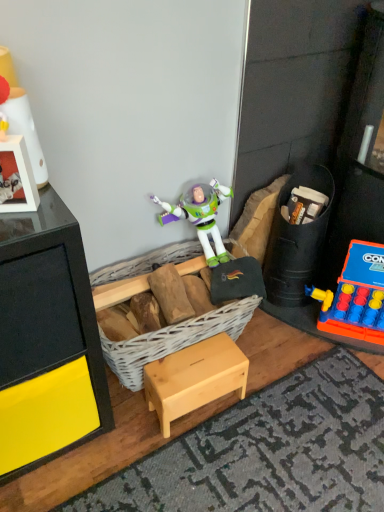
Question: Considering the relative sizes of natural wood stool at center and rubberized plastic game at right, positioned as the first toy in right-to-left order, in the image provided, is natural wood stool at center thinner than rubberized plastic game at right, positioned as the first toy in right-to-left order,?

Choices:
 (A) no
 (B) yes

Answer: (A)

Question: Is natural wood stool at center not inside rubberized plastic game at right, which appears as the 2th toy when viewed from the back?

Choices:
 (A) yes
 (B) no

Answer: (A)

Question: Is rubberized plastic game at right, which appears as the 2th toy when viewed from the back, located within natural wood stool at center?

Choices:
 (A) yes
 (B) no

Answer: (B)

Question: Can you confirm if natural wood stool at center is taller than rubberized plastic game at right, which appears as the 2th toy when viewed from the back?

Choices:
 (A) no
 (B) yes

Answer: (A)

Question: From the image's perspective, is natural wood stool at center under rubberized plastic game at right, the third toy from the left?

Choices:
 (A) yes
 (B) no

Answer: (A)

Question: Is natural wood stool at center turned away from rubberized plastic game at right, arranged as the second toy when viewed from the front?

Choices:
 (A) yes
 (B) no

Answer: (B)

Question: Can you see rubberized plastic game at right, the third toy from the left, touching matte white lamp at upper left, arranged as the third toy when viewed from the right?

Choices:
 (A) no
 (B) yes

Answer: (A)

Question: Considering the relative sizes of rubberized plastic game at right, which appears as the 2th toy when viewed from the back, and matte white lamp at upper left, which ranks as the third toy in back-to-front order, in the image provided, is rubberized plastic game at right, which appears as the 2th toy when viewed from the back, smaller than matte white lamp at upper left, which ranks as the third toy in back-to-front order,?

Choices:
 (A) yes
 (B) no

Answer: (B)

Question: Does rubberized plastic game at right, which appears as the 2th toy when viewed from the back, lie behind matte white lamp at upper left, which ranks as the third toy in back-to-front order?

Choices:
 (A) yes
 (B) no

Answer: (A)

Question: Does rubberized plastic game at right, arranged as the second toy when viewed from the front, appear on the left side of matte white lamp at upper left, which ranks as the third toy in back-to-front order?

Choices:
 (A) yes
 (B) no

Answer: (B)

Question: Is rubberized plastic game at right, the third toy from the left, shorter than matte white lamp at upper left, which ranks as the third toy in back-to-front order?

Choices:
 (A) yes
 (B) no

Answer: (B)

Question: Considering the relative positions of rubberized plastic game at right, positioned as the first toy in right-to-left order, and matte white lamp at upper left, which appears as the first toy when viewed from the front, in the image provided, is rubberized plastic game at right, positioned as the first toy in right-to-left order, to the right of matte white lamp at upper left, which appears as the first toy when viewed from the front, from the viewer's perspective?

Choices:
 (A) yes
 (B) no

Answer: (A)

Question: Can you confirm if white wicker basket at center is bigger than rubberized plastic toy at right, the 3th toy viewed from the front?

Choices:
 (A) no
 (B) yes

Answer: (B)